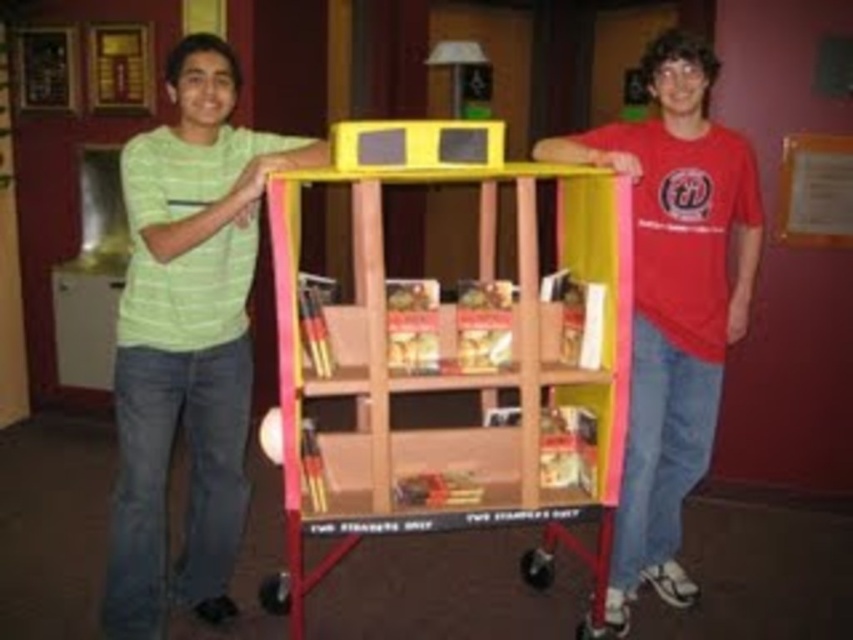
Does wooden bookshelf at center have a lesser height compared to matte red t-shirt at right?

Correct, wooden bookshelf at center is not as tall as matte red t-shirt at right.

Between point (627, 291) and point (694, 371), which one is positioned in front?

Point (627, 291) is more forward.

You are a GUI agent. You are given a task and a screenshot of the screen. Output one action in this format:
    pyautogui.click(x=<x>, y=<y>)
    Task: Click on the wooden bookshelf at center
    The image size is (853, 640).
    Given the screenshot: What is the action you would take?
    point(451,380)

Consider the image. Is wooden bookshelf at center to the left of green striped shirt at left from the viewer's perspective?

Incorrect, wooden bookshelf at center is not on the left side of green striped shirt at left.

Based on the photo, does wooden bookshelf at center appear on the right side of green striped shirt at left?

Correct, you'll find wooden bookshelf at center to the right of green striped shirt at left.

Which is in front, point (480, 278) or point (218, 70)?

Point (218, 70) is in front.

You are a GUI agent. You are given a task and a screenshot of the screen. Output one action in this format:
    pyautogui.click(x=<x>, y=<y>)
    Task: Click on the wooden bookshelf at center
    
    Given the screenshot: What is the action you would take?
    pyautogui.click(x=451, y=380)

Does green striped shirt at left have a lesser width compared to matte red t-shirt at right?

Indeed, green striped shirt at left has a lesser width compared to matte red t-shirt at right.

Find the location of a particular element. green striped shirt at left is located at coordinates (187, 337).